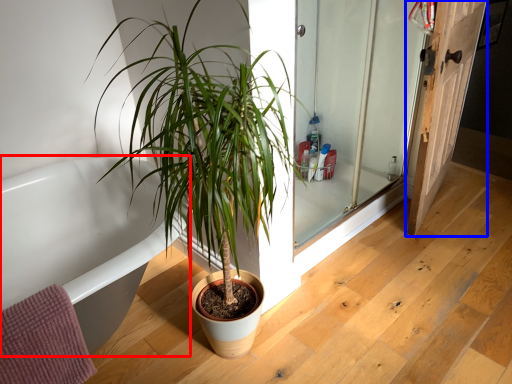
Question: Among these objects, which one is farthest to the camera, bathtub (highlighted by a red box) or door (highlighted by a blue box)?

Choices:
 (A) bathtub
 (B) door

Answer: (B)